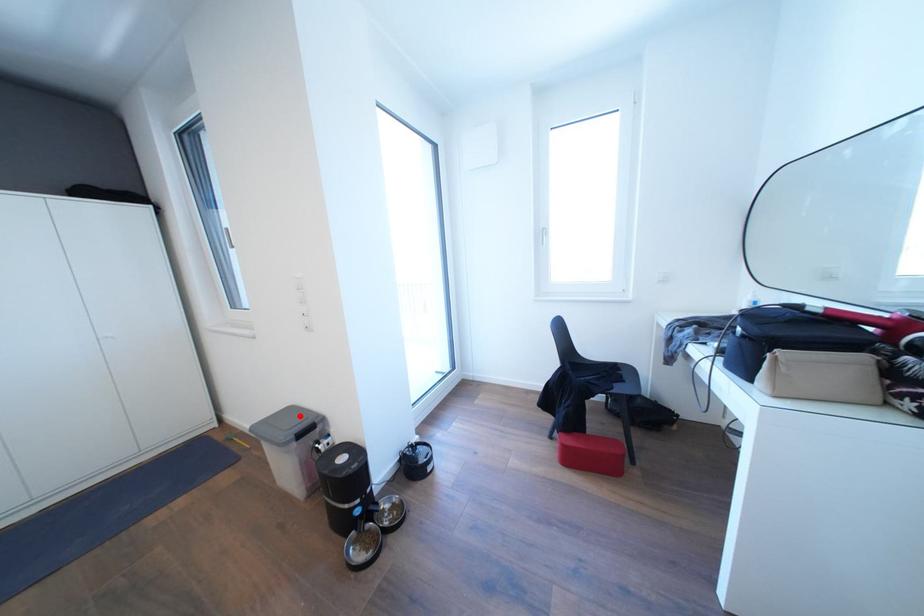
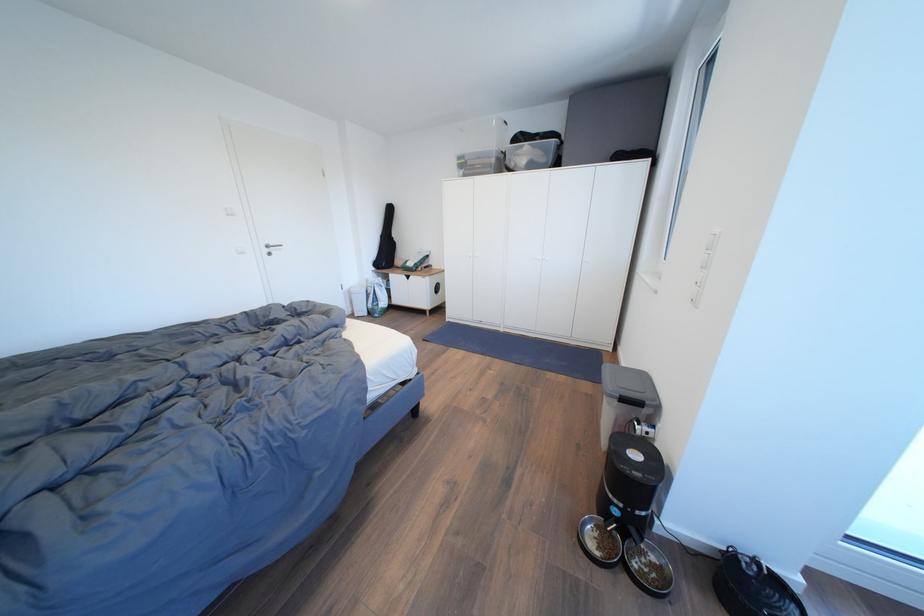
The point at the highlighted location is marked in the first image. Where is the corresponding point in the second image?

(651, 382)